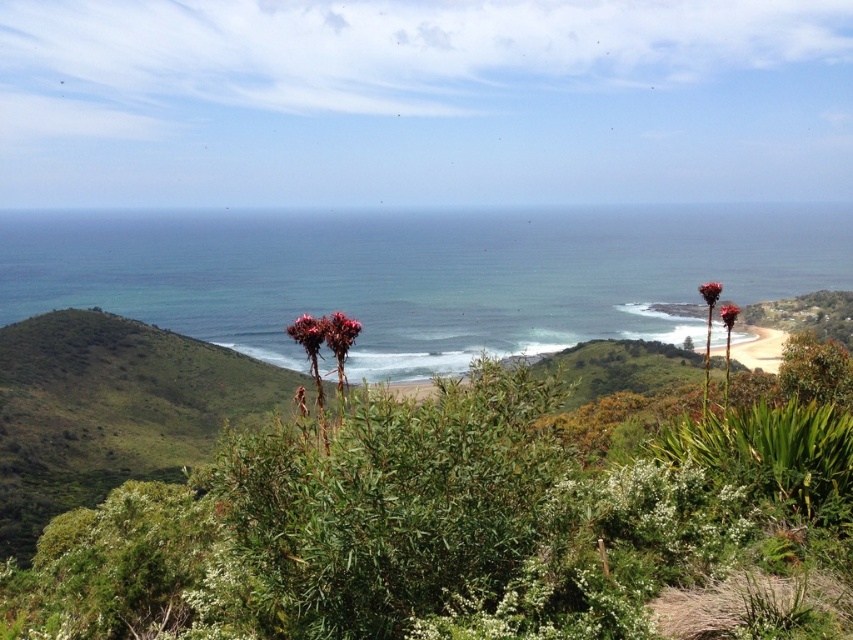
Question: Which point appears closest to the camera in this image?

Choices:
 (A) (299, 337)
 (B) (149, 531)
 (C) (6, 314)
 (D) (345, 321)

Answer: (D)

Question: Among these objects, which one is farthest from the camera?

Choices:
 (A) bumpy coral-like plant at center
 (B) blue-green water at center
 (C) green leafy shrubs at center
 (D) bumpy red flower at center

Answer: (A)

Question: Does bumpy red flower at center appear on the left side of bumpy coral-like plant at center?

Choices:
 (A) no
 (B) yes

Answer: (A)

Question: Considering the relative positions of green leafy shrubs at center and bumpy red flower at center in the image provided, where is green leafy shrubs at center located with respect to bumpy red flower at center?

Choices:
 (A) right
 (B) left

Answer: (B)

Question: Which point is farther to the camera?

Choices:
 (A) bumpy red flower at center
 (B) bumpy coral-like plant at center
 (C) blue-green water at center
 (D) green leafy shrubs at center

Answer: (B)

Question: Where is bumpy red flower at center located in relation to bumpy coral-like plant at center in the image?

Choices:
 (A) above
 (B) below

Answer: (A)